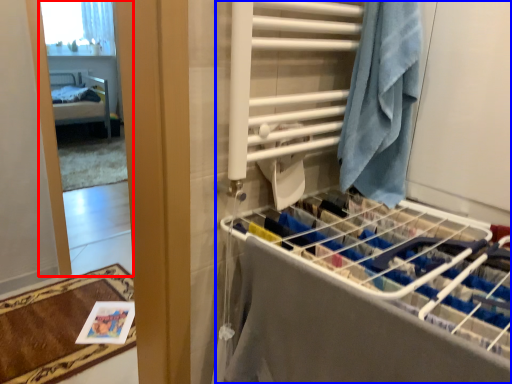
Question: Which object is closer to the camera taking this photo, mirror (highlighted by a red box) or closet (highlighted by a blue box)?

Choices:
 (A) mirror
 (B) closet

Answer: (B)